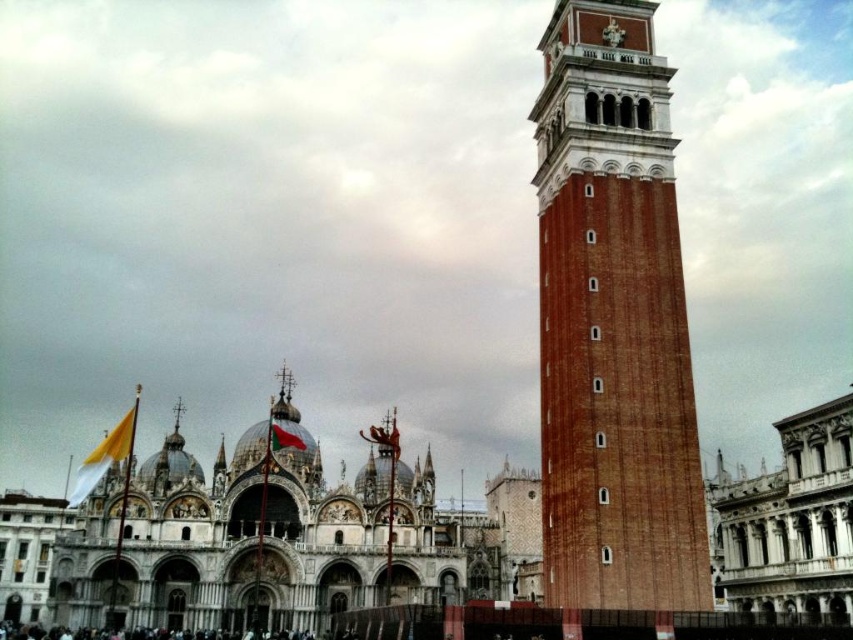
Question: Which point appears closest to the camera in this image?

Choices:
 (A) (83, 483)
 (B) (287, 442)
 (C) (624, 40)

Answer: (C)

Question: Which point is closer to the camera?

Choices:
 (A) (288, 445)
 (B) (71, 502)
 (C) (604, 464)

Answer: (C)

Question: Is brick textured bell tower at right bigger than red fabric flag at center?

Choices:
 (A) no
 (B) yes

Answer: (B)

Question: Can you confirm if brick textured bell tower at right is positioned to the left of red fabric flag at center?

Choices:
 (A) yes
 (B) no

Answer: (B)

Question: Can you confirm if white fabric flag at lower left is positioned above red fabric flag at center?

Choices:
 (A) yes
 (B) no

Answer: (B)

Question: Which object is closer to the camera taking this photo?

Choices:
 (A) red fabric flag at center
 (B) brick textured bell tower at right
 (C) white fabric flag at lower left

Answer: (B)